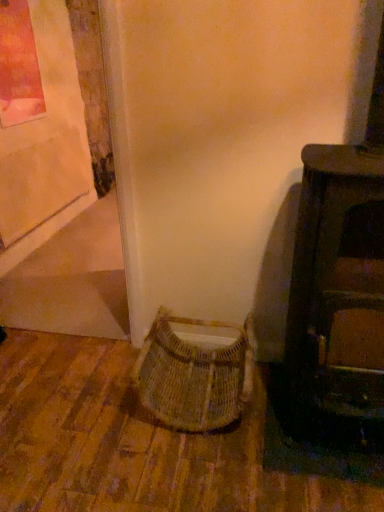
This screenshot has width=384, height=512. Describe the element at coordinates (194, 375) in the screenshot. I see `woven straw basket at lower center` at that location.

Locate an element on the screen. woven straw basket at lower center is located at coordinates (194, 375).

Locate an element on the screen. The height and width of the screenshot is (512, 384). woven straw basket at lower center is located at coordinates (194, 375).